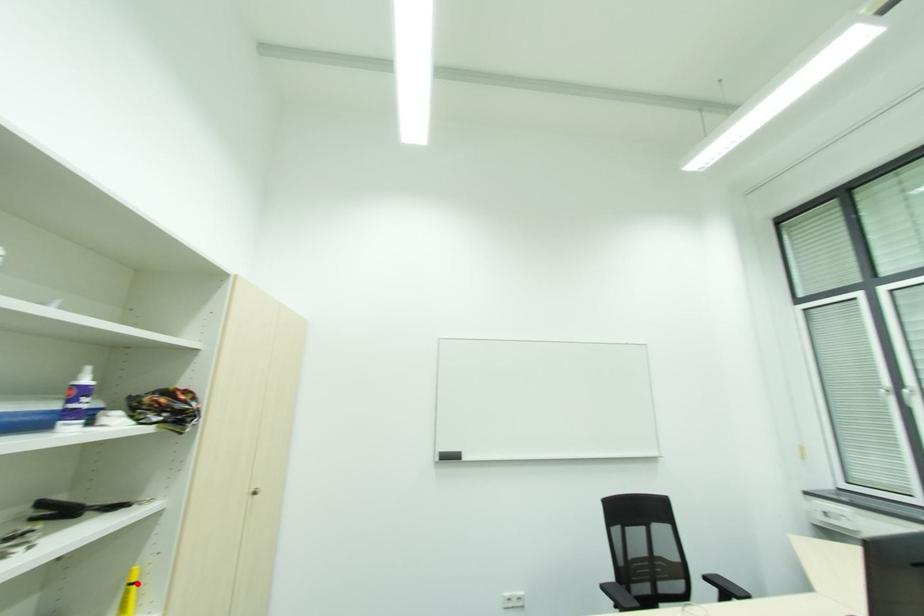
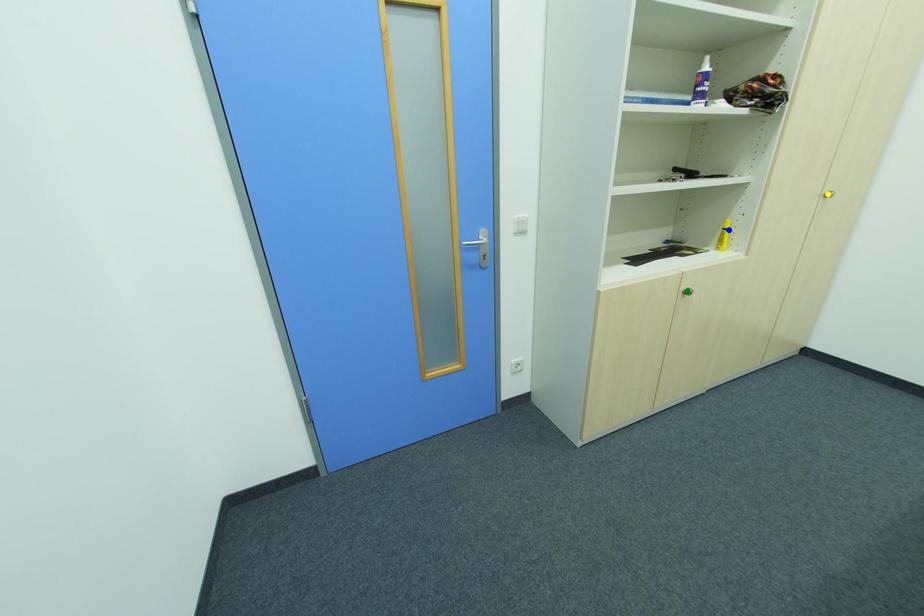
Question: I am providing you with two images of the same scene from different viewpoints. A red point is marked on the first image. You are given multiple points on the second image. Which spot in image 2 lines up with the point in image 1?

Choices:
 (A) yellow point
 (B) green point
 (C) blue point

Answer: (C)